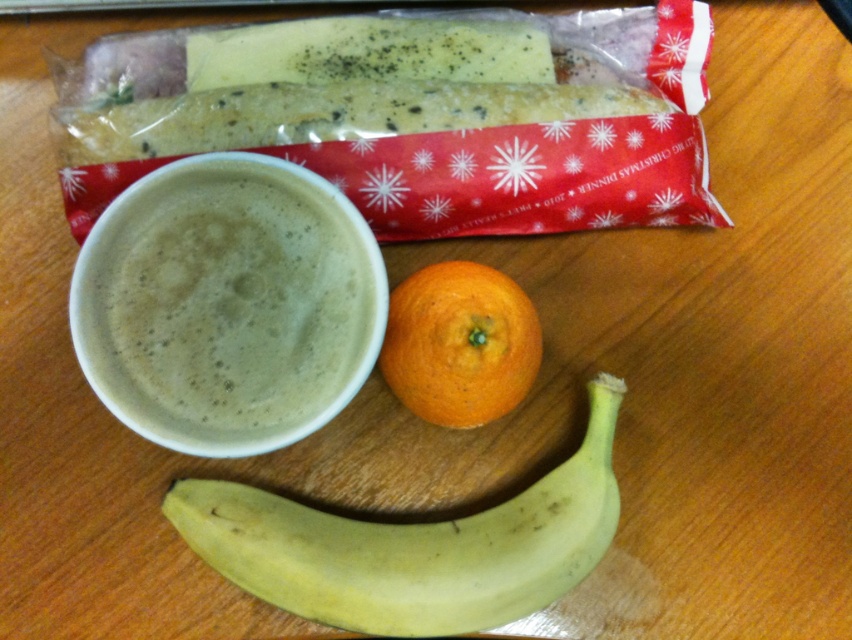
Question: Which point is farther from the camera taking this photo?

Choices:
 (A) (608, 525)
 (B) (407, 307)

Answer: (B)

Question: Is green frothy dip at upper left further to camera compared to green matte banana at lower center?

Choices:
 (A) no
 (B) yes

Answer: (A)

Question: Is green frothy dip at upper left to the left of green matte banana at lower center from the viewer's perspective?

Choices:
 (A) no
 (B) yes

Answer: (B)

Question: Considering the relative positions of green frothy dip at upper left and orangesmoothfruit at center in the image provided, where is green frothy dip at upper left located with respect to orangesmoothfruit at center?

Choices:
 (A) above
 (B) below

Answer: (A)

Question: Which object appears farthest from the camera in this image?

Choices:
 (A) green frothy dip at upper left
 (B) green matte banana at lower center

Answer: (B)

Question: Among these points, which one is farthest from the camera?

Choices:
 (A) (148, 352)
 (B) (394, 608)

Answer: (A)